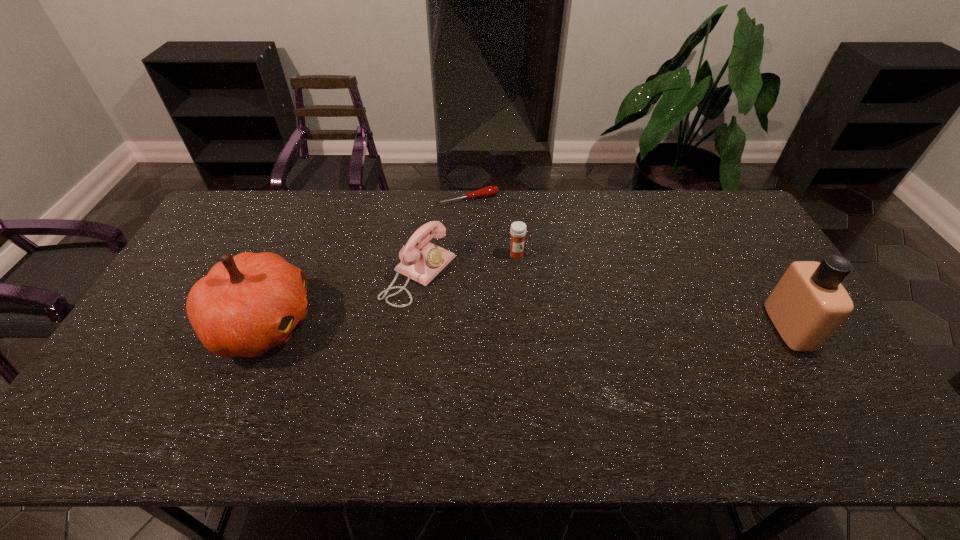
The width and height of the screenshot is (960, 540). Find the location of `pumpkin`. pumpkin is located at coordinates (247, 304).

Identify the location of the rightmost object. This screenshot has width=960, height=540. (809, 303).

Where is `the second shortest object`? The width and height of the screenshot is (960, 540). the second shortest object is located at coordinates (518, 229).

You are a GUI agent. You are given a task and a screenshot of the screen. Output one action in this format:
    pyautogui.click(x=<x>, y=<y>)
    Task: Click on the second object from right to left
    
    Given the screenshot: What is the action you would take?
    pyautogui.click(x=518, y=229)

You are a GUI agent. You are given a task and a screenshot of the screen. Output one action in this format:
    pyautogui.click(x=<x>, y=<y>)
    Task: Click on the shortest object
    
    Given the screenshot: What is the action you would take?
    [488, 191]

Where is `the farthest object`? The image size is (960, 540). the farthest object is located at coordinates (488, 191).

You are a GUI agent. You are given a task and a screenshot of the screen. Output one action in this format:
    pyautogui.click(x=<x>, y=<y>)
    Task: Click on the third tallest object
    This screenshot has height=540, width=960.
    Given the screenshot: What is the action you would take?
    pyautogui.click(x=421, y=260)

Locate an element on the screen. free space located 0.340m on the front-facing side of the leftmost object is located at coordinates (439, 324).

Where is `free space located on the label side of the second object from right to left`? This screenshot has width=960, height=540. free space located on the label side of the second object from right to left is located at coordinates (584, 327).

Locate an element on the screen. This screenshot has width=960, height=540. vacant space located on the label side of the second object from right to left is located at coordinates (559, 301).